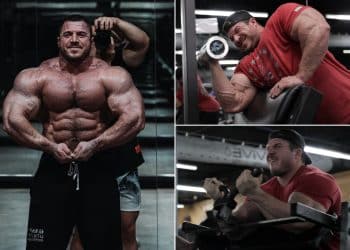
You are a GUI agent. You are given a task and a screenshot of the screen. Output one action in this format:
    pyautogui.click(x=<x>, y=<y>)
    Task: Click on the mirrors
    The height and width of the screenshot is (250, 350).
    Given the screenshot: What is the action you would take?
    pyautogui.click(x=163, y=89), pyautogui.click(x=144, y=72), pyautogui.click(x=18, y=156)